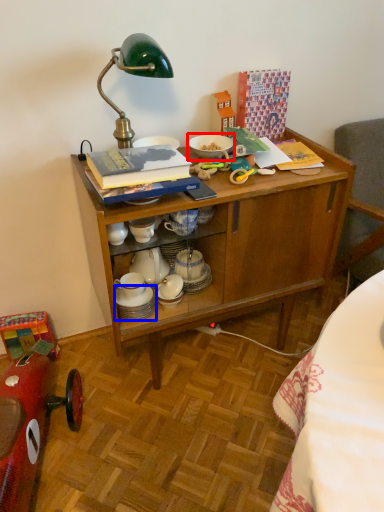
Question: Which of the following is the closest to the observer, tableware (highlighted by a red box) or tableware (highlighted by a blue box)?

Choices:
 (A) tableware
 (B) tableware

Answer: (B)